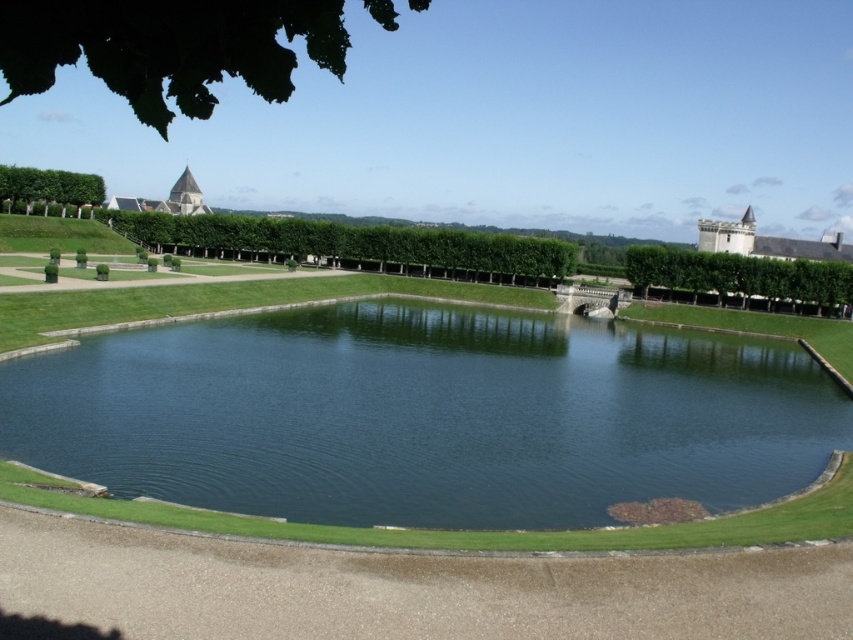
You are standing at the entrance of the garden and see the green smooth water at center. Based on its coordinates, can you determine if it is located closer to the top or bottom of the image?

The green smooth water at center is located at coordinates point (425, 417), so it is closer to the bottom of the image.

You are standing at the center of the pond and want to walk towards the green leafy hedge at upper left located at point (49,186). Which direction should you head?

You should head north because the green leafy hedge at upper left is located at point (49,186), which is north of the center of the pond.

You are standing at the center of the garden looking towards the upper left corner. There is a green leafy hedge at upper left and a smooth stone tower at upper left. Which one appears taller from your current viewpoint?

The green leafy hedge at upper left is shorter than the smooth stone tower at upper left, so the smooth stone tower at upper left appears taller from your current viewpoint.